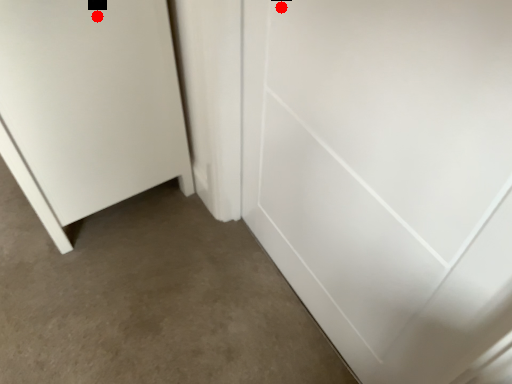
Question: Two points are circled on the image, labeled by A and B beside each circle. Which point is closer to the camera?

Choices:
 (A) A is closer
 (B) B is closer

Answer: (B)